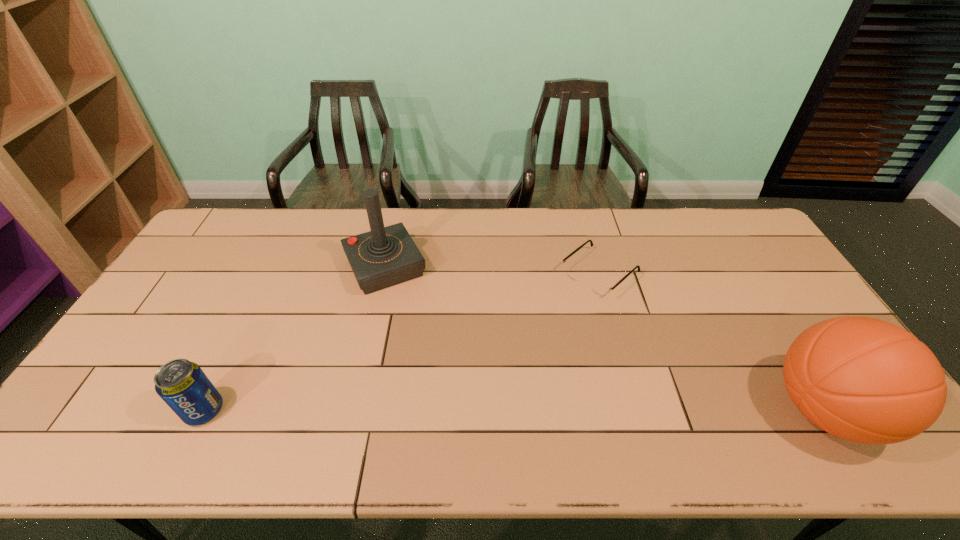
The image size is (960, 540). Find the location of `free spot on the desktop that is between the third tallest object and the basketball and is positioned on the rectangular base of the third object from right to left`. free spot on the desktop that is between the third tallest object and the basketball and is positioned on the rectangular base of the third object from right to left is located at coordinates pyautogui.click(x=458, y=410).

The height and width of the screenshot is (540, 960). In order to click on free space on the desktop that is between the soda and the rightmost object and is positioned at the hinge ends of the shortest object in this screenshot , I will do `click(440, 410)`.